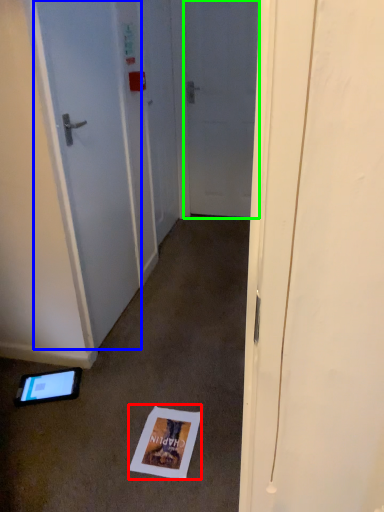
Question: Which is farther away from postcard (highlighted by a red box)? door (highlighted by a blue box) or door (highlighted by a green box)?

Choices:
 (A) door
 (B) door

Answer: (B)